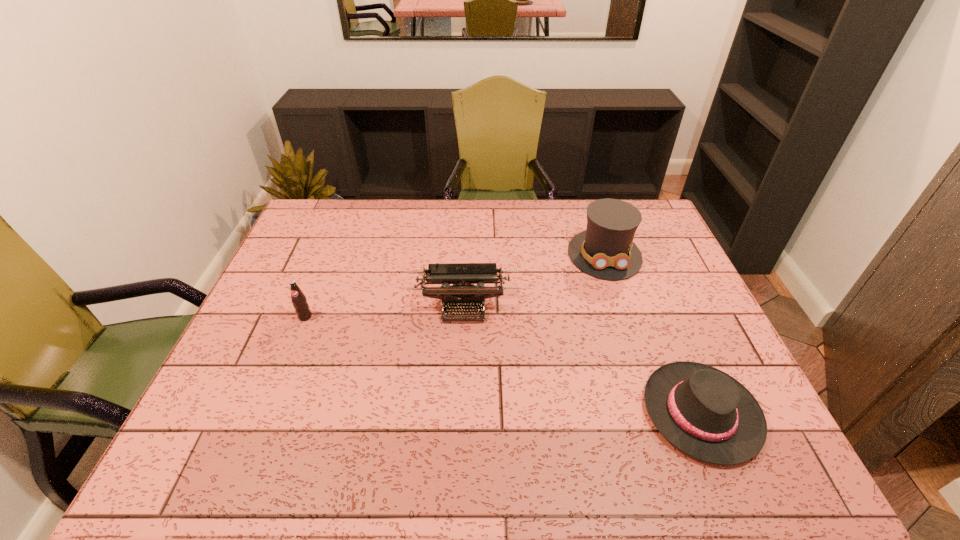
You are a GUI agent. You are given a task and a screenshot of the screen. Output one action in this format:
    pyautogui.click(x=<x>, y=<y>)
    Task: Click on the vacant region located on the left of the nearer dress hat
    The image size is (960, 540).
    Given the screenshot: What is the action you would take?
    pyautogui.click(x=596, y=413)

The image size is (960, 540). In order to click on object located at the far edge in this screenshot , I will do `click(605, 250)`.

Where is `object located at the near edge`? object located at the near edge is located at coordinates (704, 412).

Identify the location of object that is positioned at the left edge. This screenshot has height=540, width=960. (299, 300).

The image size is (960, 540). I want to click on object that is at the far right corner, so click(x=605, y=250).

Locate an element on the screen. This screenshot has height=540, width=960. object positioned at the near right corner is located at coordinates (704, 412).

Locate an element on the screen. This screenshot has width=960, height=540. vacant space at the far edge is located at coordinates (385, 207).

Image resolution: width=960 pixels, height=540 pixels. Identify the location of vacant space at the near edge. (592, 479).

The image size is (960, 540). In order to click on free space at the left edge of the desktop in this screenshot , I will do `click(323, 249)`.

The width and height of the screenshot is (960, 540). What are the coordinates of `vacant space at the right edge of the desktop` in the screenshot? It's located at (662, 262).